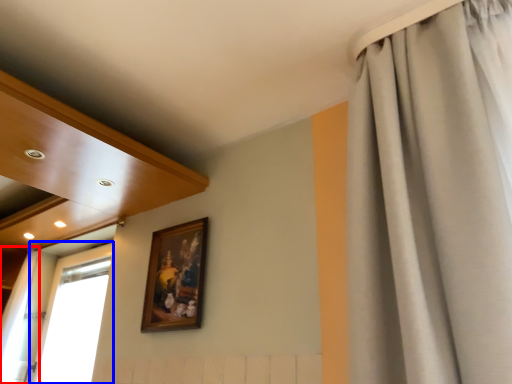
Question: Among these objects, which one is nearest to the camera, curtain (highlighted by a red box) or window (highlighted by a blue box)?

Choices:
 (A) curtain
 (B) window

Answer: (B)